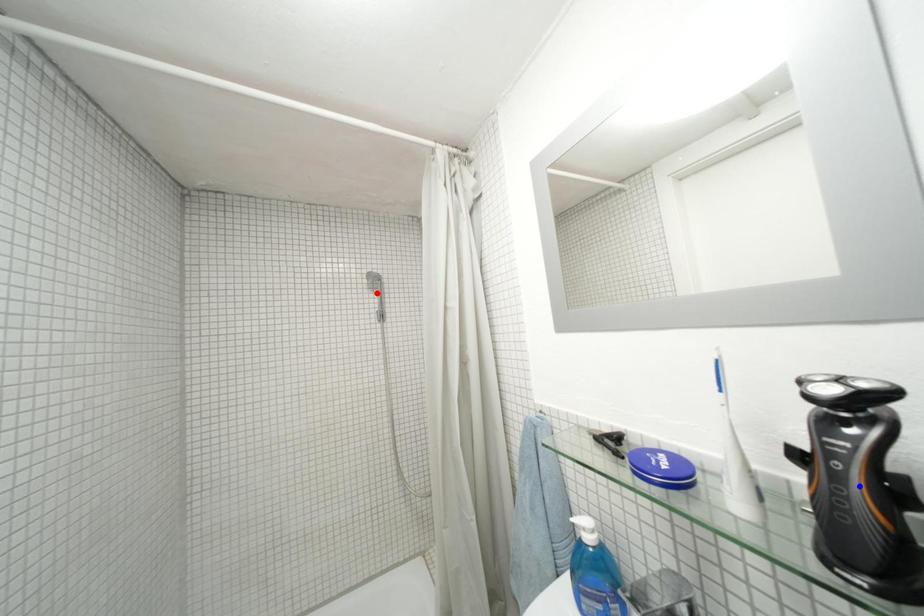
Question: Which of the two points in the image is closer to the camera?

Choices:
 (A) Blue point is closer.
 (B) Red point is closer.

Answer: (A)